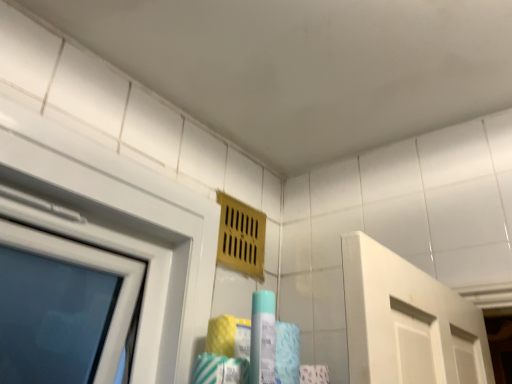
From the picture: What is the approximate height of teal matte spray can at center?

The height of teal matte spray can at center is 9.26 inches.

What do you see at coordinates (263, 338) in the screenshot?
I see `teal matte spray can at center` at bounding box center [263, 338].

Where is `teal matte spray can at center`? teal matte spray can at center is located at coordinates (263, 338).

Where is `teal matte spray can at center`? The image size is (512, 384). teal matte spray can at center is located at coordinates (263, 338).